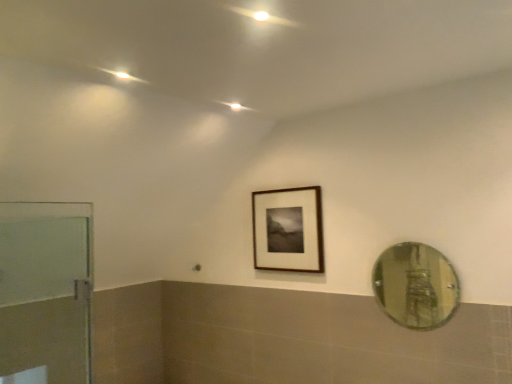
The image size is (512, 384). What do you see at coordinates (46, 292) in the screenshot?
I see `transparent glass door at left` at bounding box center [46, 292].

The height and width of the screenshot is (384, 512). I want to click on transparent glass door at left, so click(x=46, y=292).

The image size is (512, 384). Identify the location of green reflective glass mirror at right. (415, 285).

Where is `wooden frame at center`? Image resolution: width=512 pixels, height=384 pixels. wooden frame at center is located at coordinates (288, 230).

Is wooden frame at center not close to green reflective glass mirror at right?

Yes, wooden frame at center and green reflective glass mirror at right are located far from each other.

From a real-world perspective, is wooden frame at center positioned under green reflective glass mirror at right based on gravity?

Actually, wooden frame at center is physically above green reflective glass mirror at right in the real world.

Does point (322, 260) lie behind point (437, 287)?

No.

Is wooden frame at center taller or shorter than green reflective glass mirror at right?

Clearly, wooden frame at center is taller compared to green reflective glass mirror at right.

Considering the relative sizes of green reflective glass mirror at right and wooden frame at center in the image provided, is green reflective glass mirror at right bigger than wooden frame at center?

Actually, green reflective glass mirror at right might be smaller than wooden frame at center.

Is green reflective glass mirror at right facing away from wooden frame at center?

green reflective glass mirror at right does not have its back to wooden frame at center.

Would you say wooden frame at center is part of green reflective glass mirror at right's contents?

No, wooden frame at center is not a part of green reflective glass mirror at right.

From the image's perspective, is green reflective glass mirror at right above wooden frame at center?

No.

Considering the sizes of objects transparent glass door at left and wooden frame at center in the image provided, who is smaller, transparent glass door at left or wooden frame at center?

wooden frame at center.

Considering the relative positions of transparent glass door at left and wooden frame at center in the image provided, is transparent glass door at left to the right of wooden frame at center from the viewer's perspective?

Incorrect, transparent glass door at left is not on the right side of wooden frame at center.

Where is `picture frame located behind the transparent glass door at left`? Image resolution: width=512 pixels, height=384 pixels. picture frame located behind the transparent glass door at left is located at coordinates click(x=288, y=230).

In terms of width, does transparent glass door at left look wider or thinner when compared to wooden frame at center?

transparent glass door at left is wider than wooden frame at center.

Is transparent glass door at left bigger than green reflective glass mirror at right?

Indeed, transparent glass door at left has a larger size compared to green reflective glass mirror at right.

From the image's perspective, is transparent glass door at left under green reflective glass mirror at right?

Incorrect, from the image's perspective, transparent glass door at left is higher than green reflective glass mirror at right.

Is transparent glass door at left positioned with its back to green reflective glass mirror at right?

Yes, green reflective glass mirror at right is at the back of transparent glass door at left.

Considering the sizes of transparent glass door at left and green reflective glass mirror at right in the image, is transparent glass door at left wider or thinner than green reflective glass mirror at right?

Clearly, transparent glass door at left has more width compared to green reflective glass mirror at right.

Considering the sizes of objects green reflective glass mirror at right and transparent glass door at left in the image provided, who is taller, green reflective glass mirror at right or transparent glass door at left?

transparent glass door at left is taller.

At what (x,y) coordinates should I click in order to perform the action: click on door located in front of the green reflective glass mirror at right. Please return your answer as a coordinate pair (x, y). This screenshot has width=512, height=384. Looking at the image, I should click on (46, 292).

From a real-world perspective, is green reflective glass mirror at right above or below transparent glass door at left?

green reflective glass mirror at right is situated lower than transparent glass door at left in the real world.

Is green reflective glass mirror at right outside of transparent glass door at left?

green reflective glass mirror at right lies outside transparent glass door at left's area.

How distant is wooden frame at center from transparent glass door at left?

4.24 feet.

Find the location of a particular element. door below the wooden frame at center (from the image's perspective) is located at coordinates (46, 292).

Considering the sizes of objects wooden frame at center and transparent glass door at left in the image provided, who is taller, wooden frame at center or transparent glass door at left?

transparent glass door at left is taller.

At what (x,y) coordinates should I click in order to perform the action: click on picture frame lying behind the green reflective glass mirror at right. Please return your answer as a coordinate pair (x, y). The height and width of the screenshot is (384, 512). Looking at the image, I should click on (288, 230).

Find the location of a particular element. This screenshot has width=512, height=384. mirror that is under the wooden frame at center (from a real-world perspective) is located at coordinates (415, 285).

Estimate the real-world distances between objects in this image. Which object is further from green reflective glass mirror at right, wooden frame at center or transparent glass door at left?

Based on the image, transparent glass door at left appears to be further to green reflective glass mirror at right.

When comparing their distances from transparent glass door at left, does wooden frame at center or green reflective glass mirror at right seem closer?

Based on the image, wooden frame at center appears to be nearer to transparent glass door at left.

Estimate the real-world distances between objects in this image. Which object is further from green reflective glass mirror at right, transparent glass door at left or wooden frame at center?

The object further to green reflective glass mirror at right is transparent glass door at left.

Estimate the real-world distances between objects in this image. Which object is further from wooden frame at center, green reflective glass mirror at right or transparent glass door at left?

green reflective glass mirror at right.

Estimate the real-world distances between objects in this image. Which object is closer to transparent glass door at left, green reflective glass mirror at right or wooden frame at center?

Among the two, wooden frame at center is located nearer to transparent glass door at left.

Estimate the real-world distances between objects in this image. Which object is further from wooden frame at center, transparent glass door at left or green reflective glass mirror at right?

green reflective glass mirror at right.

At what (x,y) coordinates should I click in order to perform the action: click on picture frame between transparent glass door at left and green reflective glass mirror at right from left to right. Please return your answer as a coordinate pair (x, y). Looking at the image, I should click on (288, 230).